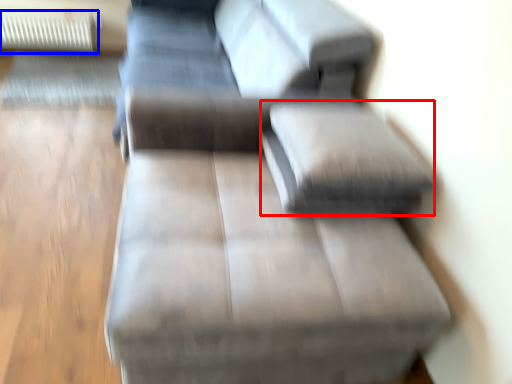
Question: Which point is closer to the camera, pillow (highlighted by a red box) or radiator (highlighted by a blue box)?

Choices:
 (A) pillow
 (B) radiator

Answer: (A)